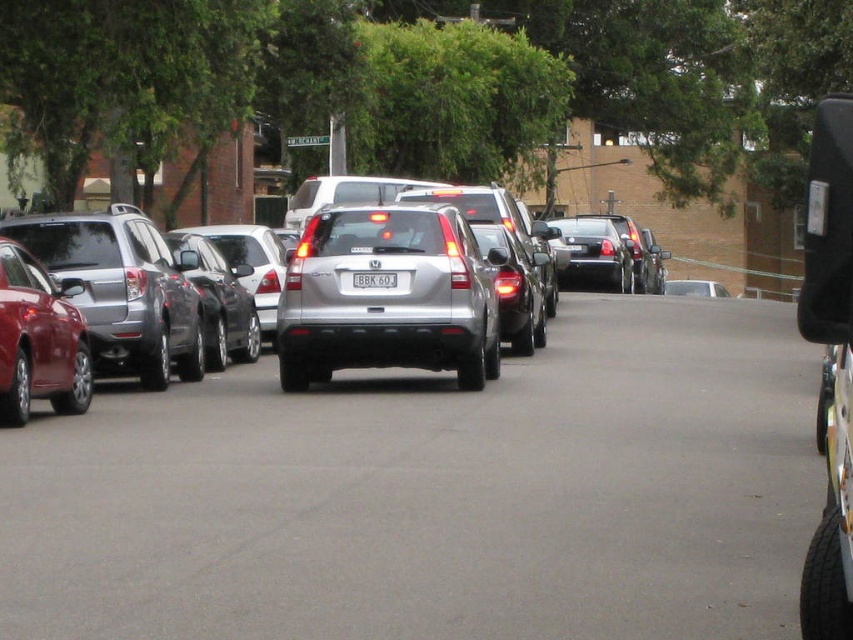
Question: Is shiny red sedan at left positioned in front of white plastic license plate at center?

Choices:
 (A) no
 (B) yes

Answer: (B)

Question: Does silver metallic suv at center have a greater width compared to satin silver suv at center?

Choices:
 (A) yes
 (B) no

Answer: (B)

Question: Which point is farther to the camera?

Choices:
 (A) shiny red sedan at left
 (B) satin silver suv at center
 (C) white plastic license plate at center

Answer: (C)

Question: Is shiny red sedan at left below white plastic license plate at center?

Choices:
 (A) yes
 (B) no

Answer: (A)

Question: Among these objects, which one is nearest to the camera?

Choices:
 (A) satin silver suv at center
 (B) shiny red sedan at left

Answer: (B)

Question: Which object is the closest to the shiny red sedan at left?

Choices:
 (A) satin silver suv at center
 (B) silver metallic suv at center
 (C) white plastic license plate at center

Answer: (B)